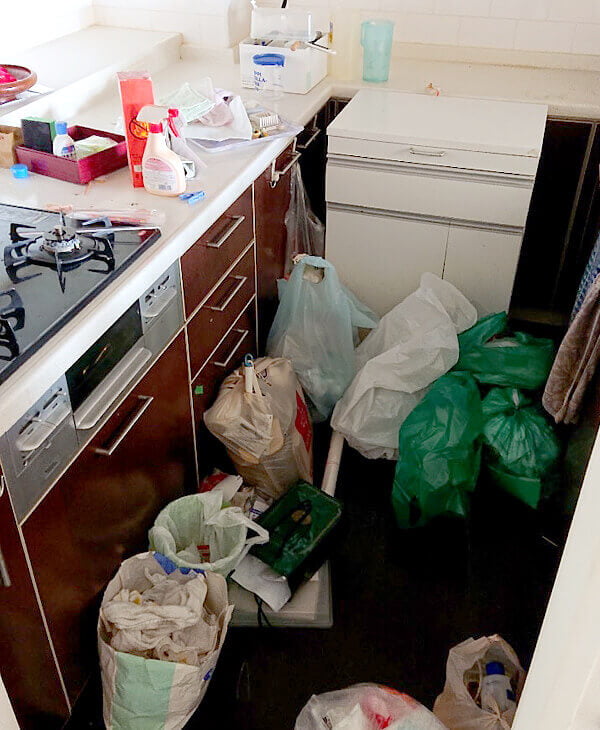
The height and width of the screenshot is (730, 600). Identify the location of pink box. (54, 165).